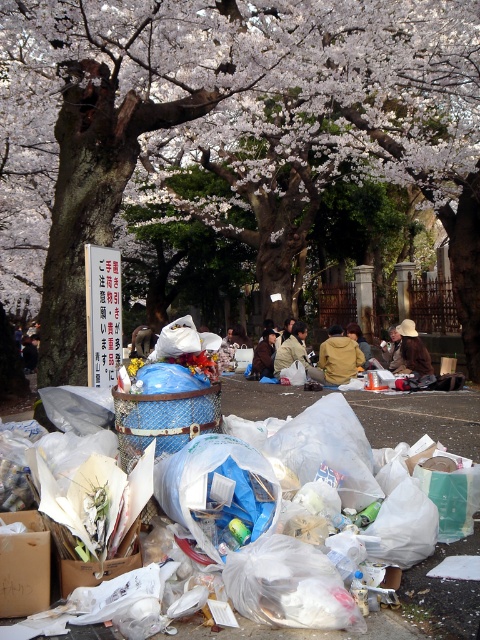
Who is positioned more to the right, brown woven hat at center or brown leather jacket at center?

brown woven hat at center

Does brown woven hat at center lie in front of brown leather jacket at center?

Yes, it is in front of brown leather jacket at center.

Which is in front, point (409, 355) or point (360, 330)?

Positioned in front is point (409, 355).

This screenshot has height=640, width=480. Identify the location of brown woven hat at center. (412, 349).

Can you confirm if white plastic bags at lower center is positioned above brown leather jacket at center?

Incorrect, white plastic bags at lower center is not positioned above brown leather jacket at center.

Can you confirm if white plastic bags at lower center is smaller than brown leather jacket at center?

Yes.

Is point (288, 388) positioned before point (367, 346)?

Yes, point (288, 388) is in front of point (367, 346).

Identify the location of white plastic bags at lower center. This screenshot has height=640, width=480. (420, 419).

Is smooth bark tree at center further to the viewer compared to brown fabric bag at center?

No, smooth bark tree at center is in front of brown fabric bag at center.

Does point (325, 100) lie behind point (333, 380)?

Yes.

Is point (240, 157) positioned after point (327, 364)?

Yes, it is.

This screenshot has width=480, height=640. Identify the location of smooth bark tree at center. (252, 122).